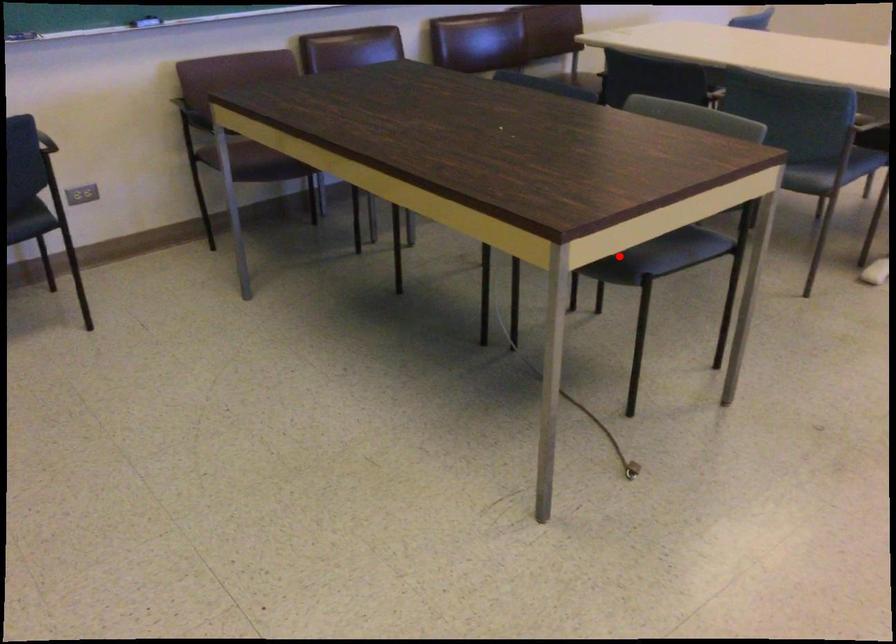
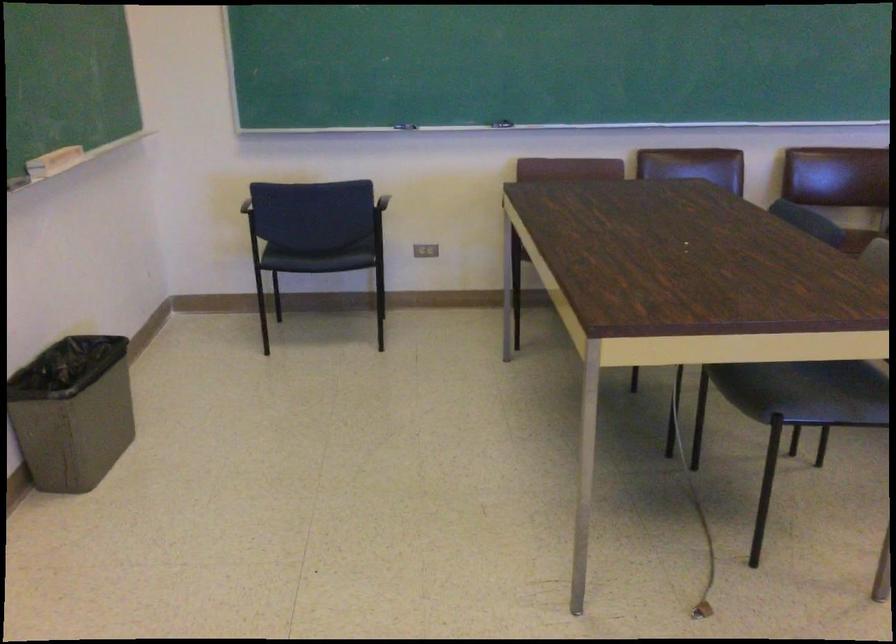
In the second image, find the point that corresponds to the highlighted location in the first image.

(765, 391)